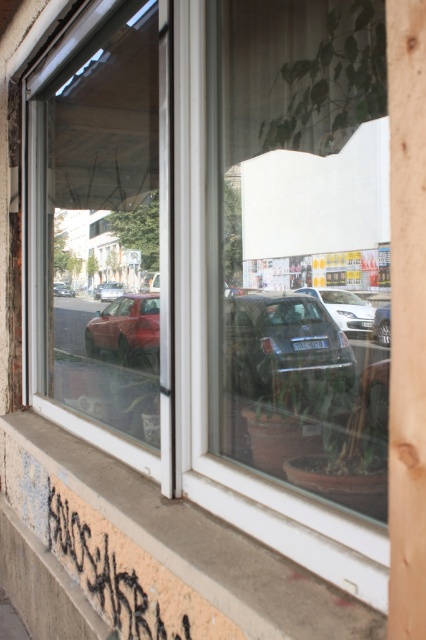
Question: Considering the real-world distances, which object is closest to the black graffiti at lower left?

Choices:
 (A) shiny metallic car at center
 (B) transparent glass window at left
 (C) metallic red car at center
 (D) matte red car at left

Answer: (D)

Question: Which point appears farthest from the camera in this image?

Choices:
 (A) (54, 291)
 (B) (238, 378)
 (C) (154, 328)

Answer: (C)

Question: Is shiny red car at left further to the viewer compared to matte red car at left?

Choices:
 (A) yes
 (B) no

Answer: (A)

Question: Does black graffiti at lower left come in front of shiny red car at left?

Choices:
 (A) yes
 (B) no

Answer: (A)

Question: Estimate the real-world distances between objects in this image. Which object is closer to the metallic red car at center?

Choices:
 (A) shiny metallic car at center
 (B) satin silver sedan at center
 (C) shiny red car at left

Answer: (C)

Question: Is shiny metallic car at center in front of matte red car at left?

Choices:
 (A) yes
 (B) no

Answer: (B)